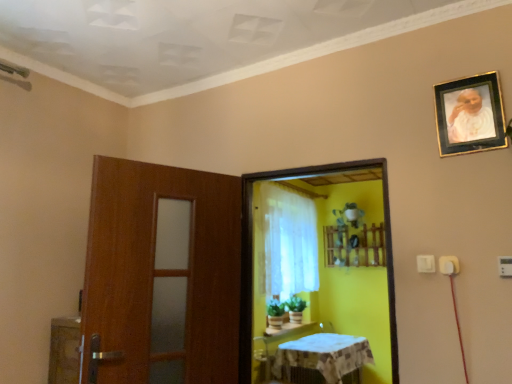
Question: Does point tap(366, 238) appear closer or farther from the camera than point tap(477, 92)?

Choices:
 (A) closer
 (B) farther

Answer: (B)

Question: In the image, is wooden shelf at center positioned in front of or behind gold-framed photo at upper right?

Choices:
 (A) front
 (B) behind

Answer: (B)

Question: Estimate the real-world distances between objects in this image. Which object is farther from the white sheer curtain at center?

Choices:
 (A) white textured tablecloth at lower center
 (B) yellow matte screen door at center
 (C) white glossy table at lower center
 (D) wooden shelf at center
 (E) gold-framed photo at upper right

Answer: (E)

Question: Which of these objects is positioned farthest from the white textured tablecloth at lower center?

Choices:
 (A) white glossy table at lower center
 (B) wooden shelf at center
 (C) yellow matte screen door at center
 (D) white sheer curtain at center
 (E) gold-framed photo at upper right

Answer: (E)